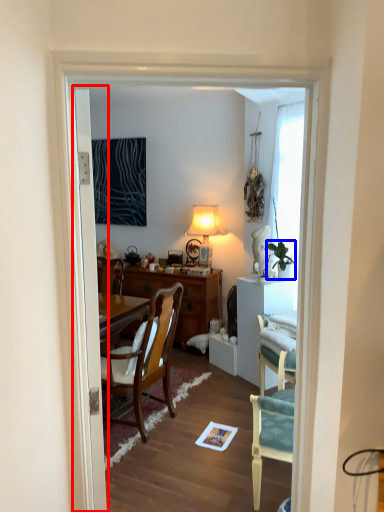
Question: Among these objects, which one is nearest to the camera, door (highlighted by a red box) or houseplant (highlighted by a blue box)?

Choices:
 (A) door
 (B) houseplant

Answer: (A)